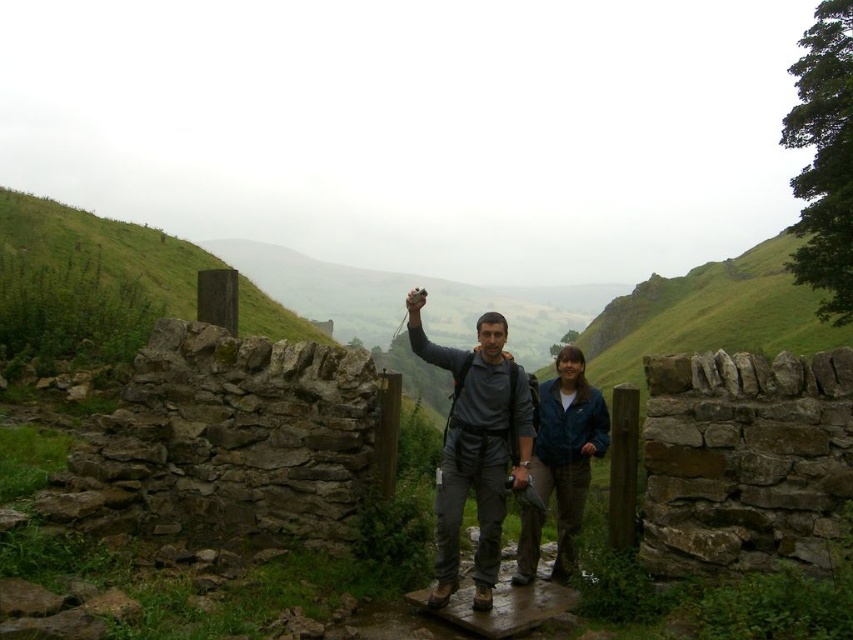
Who is more distant from viewer, (65,259) or (572,468)?

The point (65,259) is behind.

Can you confirm if green grass at upper left is bigger than blue fabric jacket at center?

Indeed, green grass at upper left has a larger size compared to blue fabric jacket at center.

Does point (15, 234) lie behind point (558, 435)?

Yes, point (15, 234) is farther from viewer.

I want to click on green grass at upper left, so click(103, 248).

Does matte gray backpack at center come in front of green grass at upper left?

That is True.

Does matte gray backpack at center come behind green grass at upper left?

That is False.

The height and width of the screenshot is (640, 853). Describe the element at coordinates (477, 445) in the screenshot. I see `matte gray backpack at center` at that location.

Find the location of a particular element. The height and width of the screenshot is (640, 853). matte gray backpack at center is located at coordinates [x=477, y=445].

Who is positioned more to the right, matte gray backpack at center or blue fabric jacket at center?

From the viewer's perspective, blue fabric jacket at center appears more on the right side.

Does matte gray backpack at center have a lesser height compared to blue fabric jacket at center?

No.

Does point (532, 433) come closer to viewer compared to point (575, 417)?

That is True.

Locate an element on the screen. This screenshot has height=640, width=853. matte gray backpack at center is located at coordinates (477, 445).